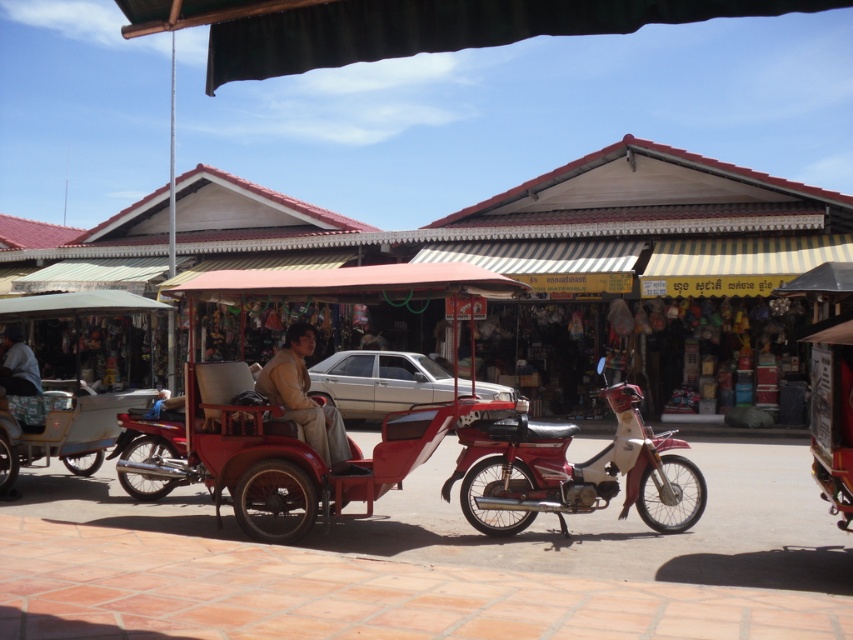
You are a delivery person needing to load a tall package onto either the wooden cart at center or the silver metallic car at center. Which vehicle can accommodate the height of the package?

The wooden cart at center is taller than the silver metallic car at center, so the wooden cart at center can accommodate the tall package.